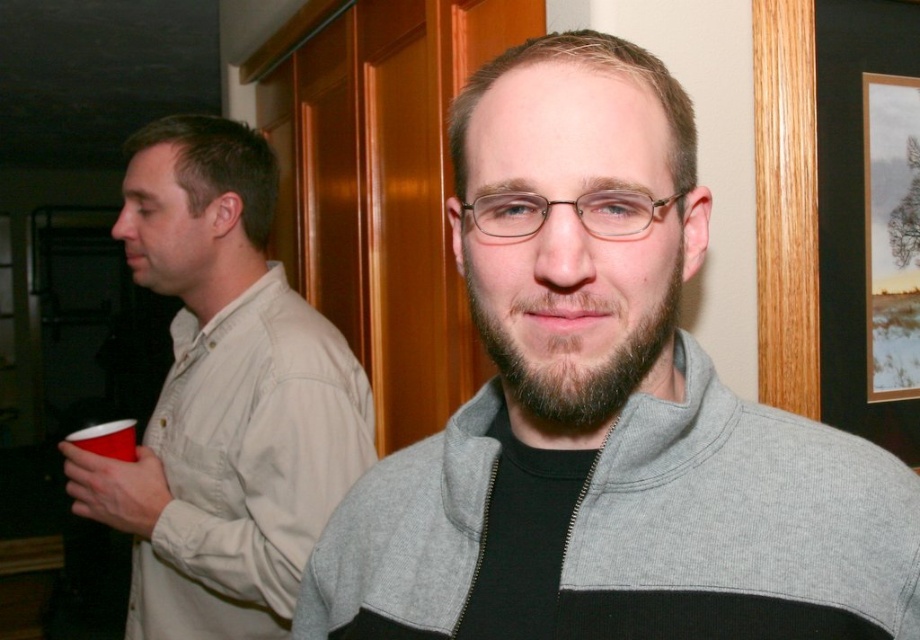
Does wooden picture frame at right have a smaller size compared to brown fuzzy beard at center?

Actually, wooden picture frame at right might be larger than brown fuzzy beard at center.

Identify the location of wooden picture frame at right. (838, 212).

Locate an element on the screen. wooden picture frame at right is located at coordinates pyautogui.click(x=838, y=212).

Consider the image. Is beige shirt at left shorter than brown fuzzy beard at center?

No, beige shirt at left is not shorter than brown fuzzy beard at center.

Is the position of beige shirt at left more distant than that of brown fuzzy beard at center?

Yes.

Is point (250, 596) closer to viewer compared to point (592, 408)?

No.

Locate an element on the screen. beige shirt at left is located at coordinates (224, 397).

Which is more to the left, beige shirt at left or wooden picture frame at right?

beige shirt at left

Which of these two, beige shirt at left or wooden picture frame at right, stands taller?

beige shirt at left

Does point (250, 189) come behind point (900, 280)?

That is False.

You are a GUI agent. You are given a task and a screenshot of the screen. Output one action in this format:
    pyautogui.click(x=<x>, y=<y>)
    Task: Click on the beige shirt at left
    The height and width of the screenshot is (640, 920).
    Given the screenshot: What is the action you would take?
    point(224,397)